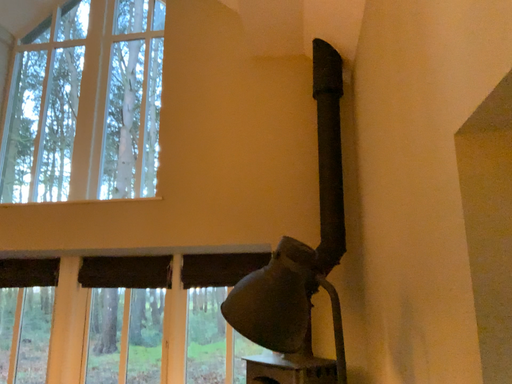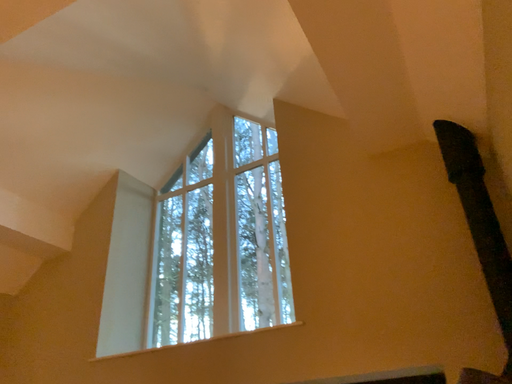
Question: How did the camera likely rotate when shooting the video?

Choices:
 (A) rotated upward
 (B) rotated downward

Answer: (A)